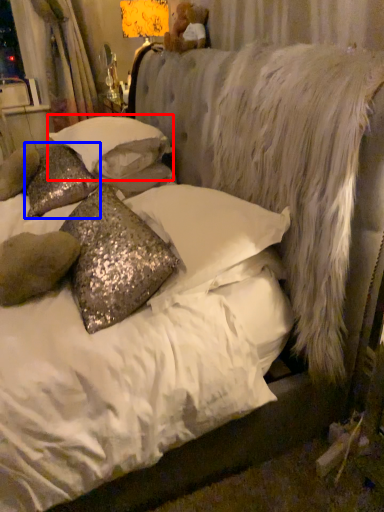
Question: Which object is closer to the camera taking this photo, pillow (highlighted by a red box) or pillow (highlighted by a blue box)?

Choices:
 (A) pillow
 (B) pillow

Answer: (A)